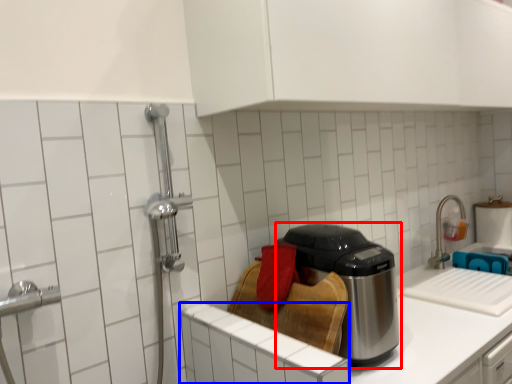
Question: Which object is further to the camera taking this photo, kitchen appliance (highlighted by a red box) or cabinetry (highlighted by a blue box)?

Choices:
 (A) kitchen appliance
 (B) cabinetry

Answer: (A)